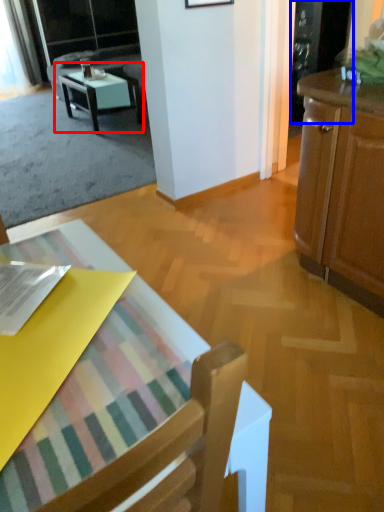
Question: Which of the following is the farthest to the observer, table (highlighted by a red box) or screen door (highlighted by a blue box)?

Choices:
 (A) table
 (B) screen door

Answer: (A)